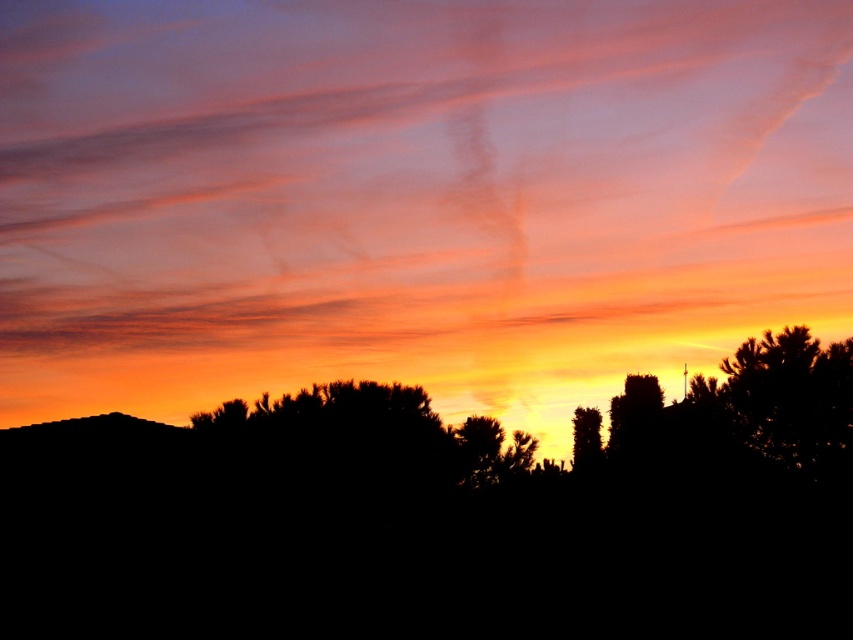
You are an artist trying to paint the sunset scene. You notice the translucent orange cloud at upper center and the silhouette tree at center. Which object should you paint first if you want to follow the rule of painting wider objects before narrower ones?

You should paint the translucent orange cloud at upper center first because its width surpasses that of the silhouette tree at center, following the rule of painting wider objects before narrower ones.

You are an astronomer observing the sunset and notice the translucent orange cloud at upper center and the silhouette tree at center. Which object is closer to your line of sight?

The translucent orange cloud at upper center is closer to your line of sight because it is positioned further to the viewer than the silhouette tree at center.